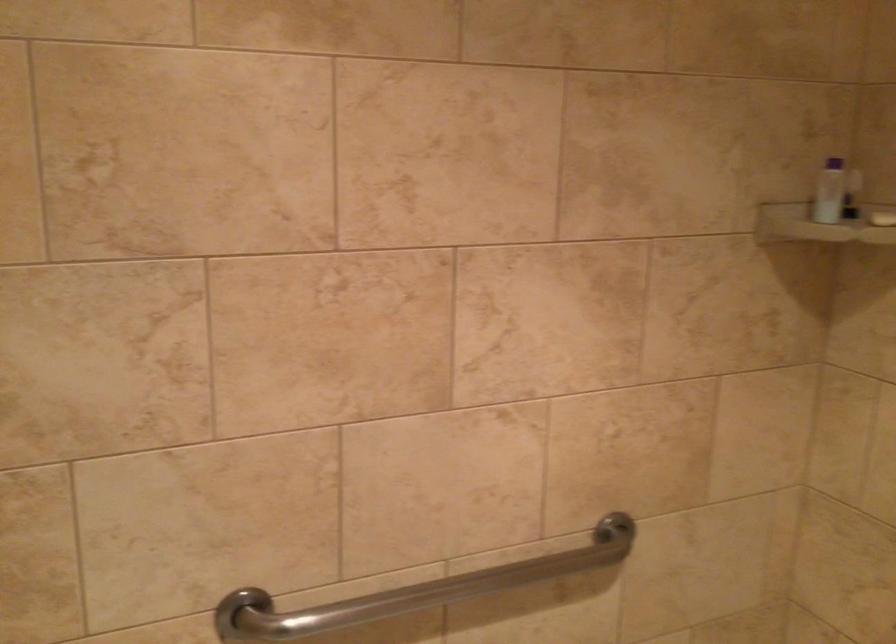
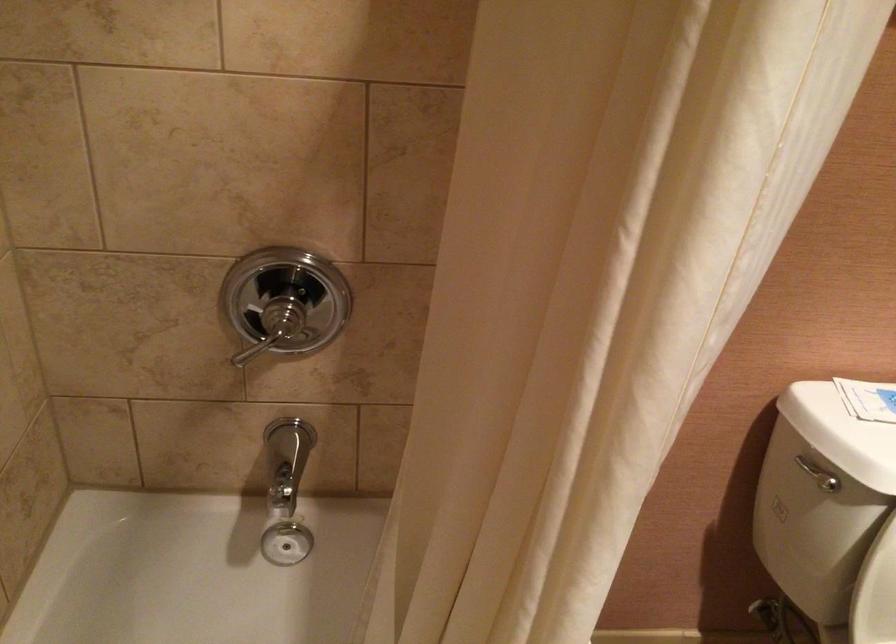
The images are taken continuously from a first-person perspective. In which direction is your viewpoint rotating?

The camera's rotation is toward right-down.